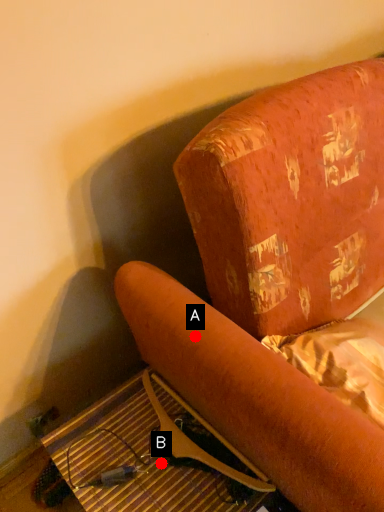
Question: Two points are circled on the image, labeled by A and B beside each circle. Which point is farther to the camera?

Choices:
 (A) A is further
 (B) B is further

Answer: (B)